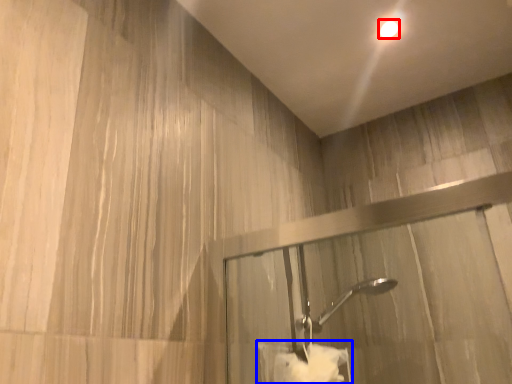
Question: Which point is further to the camera, droplight (highlighted by a red box) or bath towel (highlighted by a blue box)?

Choices:
 (A) droplight
 (B) bath towel

Answer: (A)